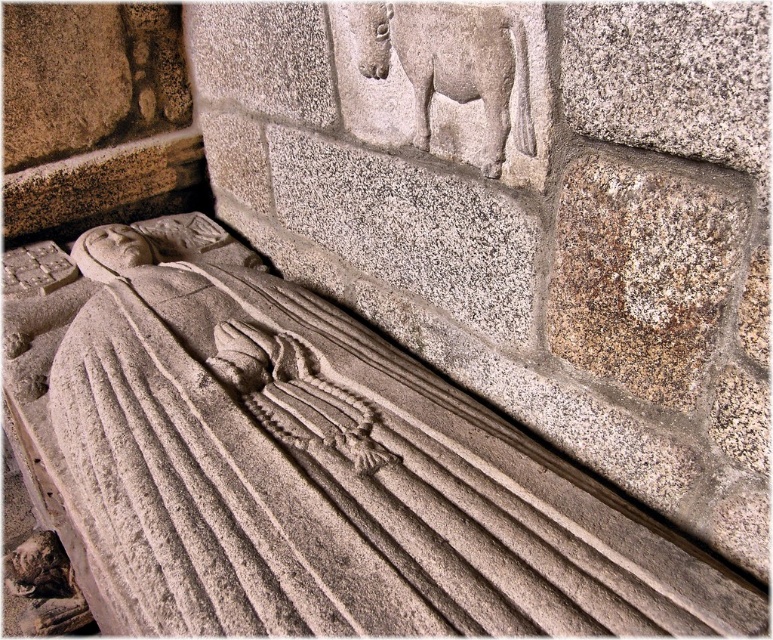
You are an archaeologist examining the stone sarcophagus. You notice the gray stone carving at center and the gray stone horse at upper center. Which object takes up more space in the image?

The gray stone carving at center is bigger than the gray stone horse at upper center, so it takes up more space in the image.

You are an archaeologist examining the stone sarcophagus and notice the gray stone carving at center and the gray stone horse at upper center. Which object is closer to you in the scene?

The gray stone carving at center is closer to you because it is in front of the gray stone horse at upper center.